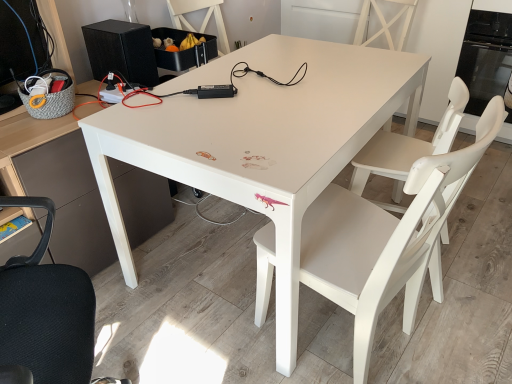
Locate an element on the screen. The width and height of the screenshot is (512, 384). free location to the right of white matte chair at center is located at coordinates (477, 246).